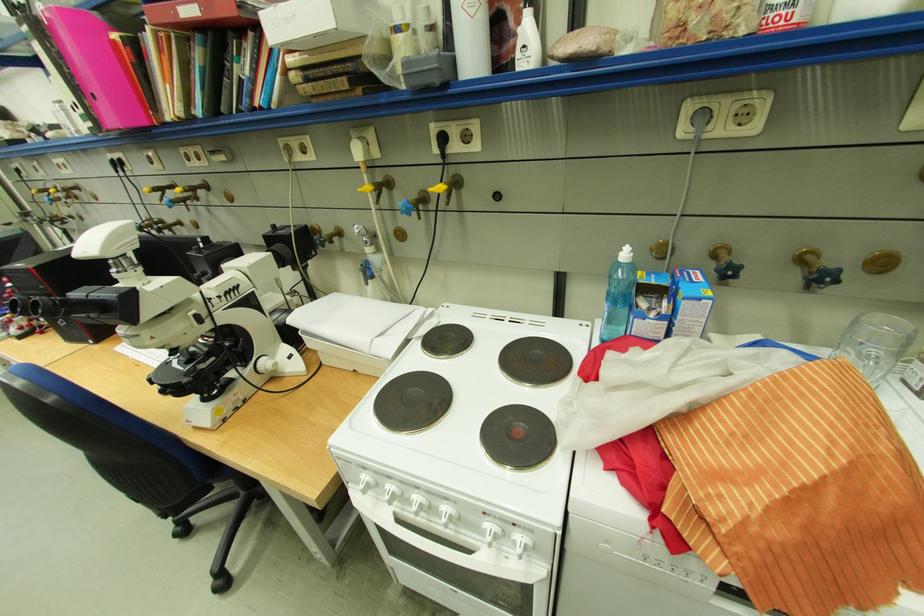
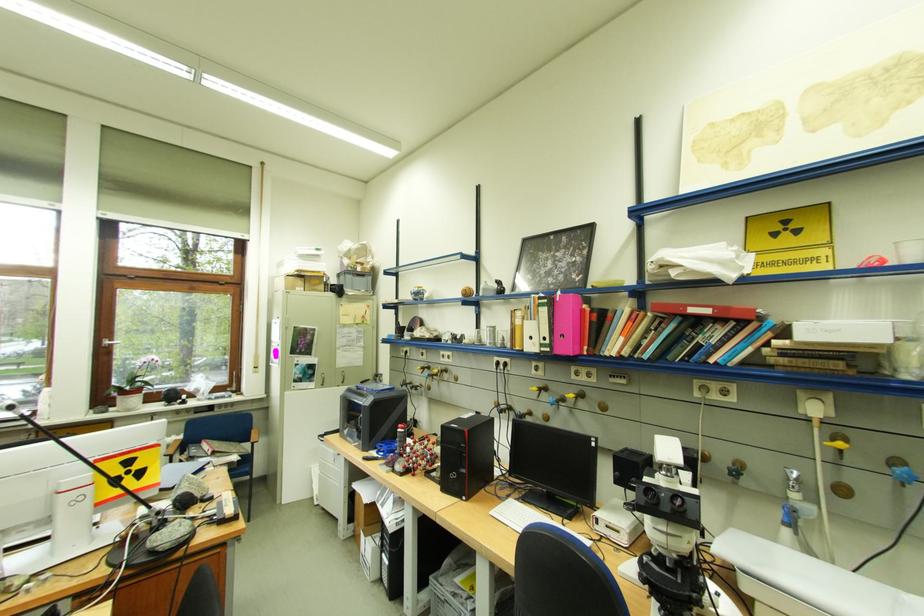
Locate, in the second image, the point that corresponds to point 157,190 in the first image.

(544, 390)